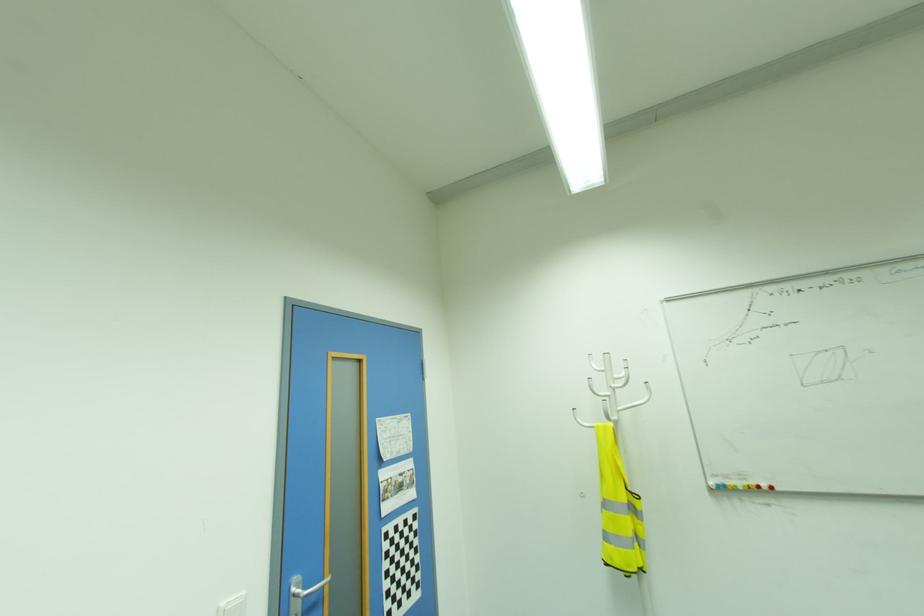
At what (x,y) coordinates should I click in order to perform the action: click on white light switch. Please return your answer as a coordinate pair (x, y). The width and height of the screenshot is (924, 616). Looking at the image, I should click on (233, 606).